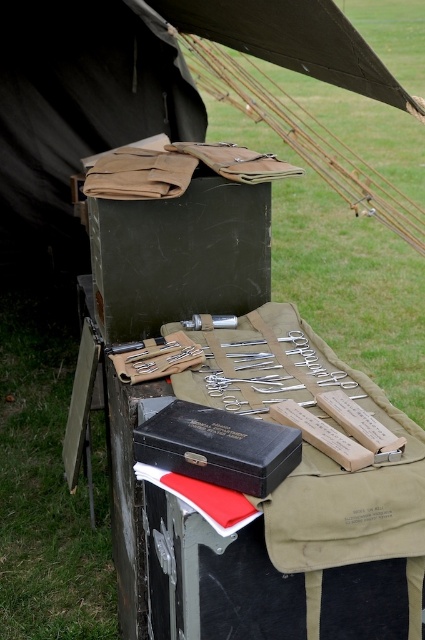
Question: Among these objects, which one is nearest to the camera?

Choices:
 (A) black leather box at center
 (B) black matte box at center
 (C) matte brown canvas tent at upper center

Answer: (A)

Question: Can you confirm if black leather box at center is bigger than metallic silver tool at center?

Choices:
 (A) no
 (B) yes

Answer: (B)

Question: Can you confirm if matte black box at center is wider than metallic silver tool at center?

Choices:
 (A) no
 (B) yes

Answer: (B)

Question: Which point appears farthest from the camera in this image?

Choices:
 (A) (96, 26)
 (B) (275, 432)

Answer: (A)

Question: Among these points, which one is farthest from the camera?

Choices:
 (A) (0, 68)
 (B) (186, 328)
 (C) (161, 444)
 (D) (237, 262)

Answer: (A)

Question: In this image, where is matte brown canvas tent at upper center located relative to matte black box at center?

Choices:
 (A) right
 (B) left

Answer: (B)